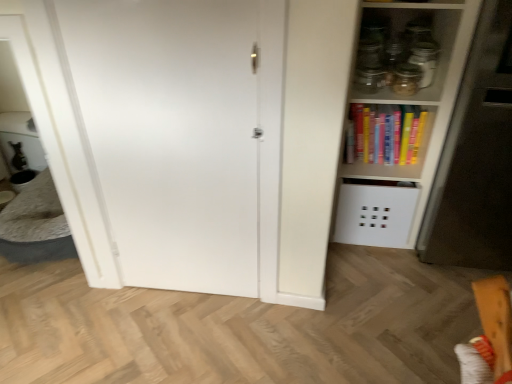
Question: Are hardcover books at upper right and transparent glass jar at upper right, the first glass jar in the right-to-left sequence, far apart?

Choices:
 (A) yes
 (B) no

Answer: (B)

Question: From a real-world perspective, is hardcover books at upper right on transparent glass jar at upper right, the second glass jar in the left-to-right sequence?

Choices:
 (A) no
 (B) yes

Answer: (A)

Question: Is hardcover books at upper right with transparent glass jar at upper right, the first glass jar in the right-to-left sequence?

Choices:
 (A) no
 (B) yes

Answer: (A)

Question: Is hardcover books at upper right outside of transparent glass jar at upper right, the first glass jar in the right-to-left sequence?

Choices:
 (A) yes
 (B) no

Answer: (A)

Question: Does hardcover books at upper right have a lesser width compared to transparent glass jar at upper right, the second glass jar in the left-to-right sequence?

Choices:
 (A) yes
 (B) no

Answer: (B)

Question: Visually, is white matte door at center positioned to the left or to the right of transparent glass jar at upper right, the second glass jar in the left-to-right sequence?

Choices:
 (A) left
 (B) right

Answer: (A)

Question: Is point (231, 251) positioned closer to the camera than point (423, 43)?

Choices:
 (A) farther
 (B) closer

Answer: (B)

Question: Is white matte door at center in front of or behind transparent glass jar at upper right, the second glass jar in the left-to-right sequence, in the image?

Choices:
 (A) behind
 (B) front

Answer: (B)

Question: Looking at the image, does white matte door at center seem bigger or smaller compared to transparent glass jar at upper right, the second glass jar in the left-to-right sequence?

Choices:
 (A) small
 (B) big

Answer: (B)

Question: Considering their positions, is white matte door at center located in front of or behind transparent glass jar at upper right, which appears as the first glass jar when viewed from the left?

Choices:
 (A) behind
 (B) front

Answer: (B)

Question: Is white matte door at center to the left or to the right of transparent glass jar at upper right, which appears as the first glass jar when viewed from the left, in the image?

Choices:
 (A) right
 (B) left

Answer: (B)

Question: Is white matte door at center situated inside transparent glass jar at upper right, which appears as the first glass jar when viewed from the left, or outside?

Choices:
 (A) inside
 (B) outside

Answer: (B)

Question: In terms of width, does white matte door at center look wider or thinner when compared to transparent glass jar at upper right, the second glass jar positioned from the right?

Choices:
 (A) thin
 (B) wide

Answer: (A)

Question: In the image, is white matte fridge at right on the left side or the right side of transparent glass jar at upper right, which appears as the first glass jar when viewed from the left?

Choices:
 (A) right
 (B) left

Answer: (A)

Question: From the image's perspective, relative to transparent glass jar at upper right, the second glass jar positioned from the right, is white matte fridge at right above or below?

Choices:
 (A) below
 (B) above

Answer: (A)